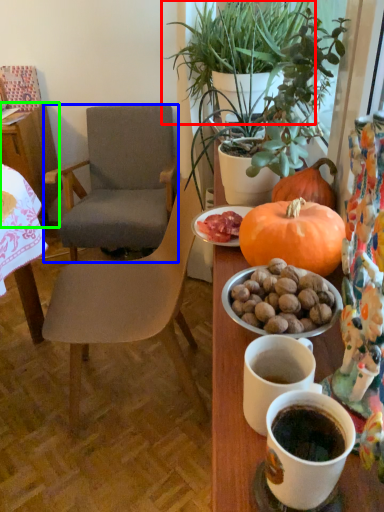
Question: Which object is the farthest from houseplant (highlighted by a red box)? Choose among these: chair (highlighted by a blue box) or table (highlighted by a green box).

Choices:
 (A) chair
 (B) table

Answer: (B)